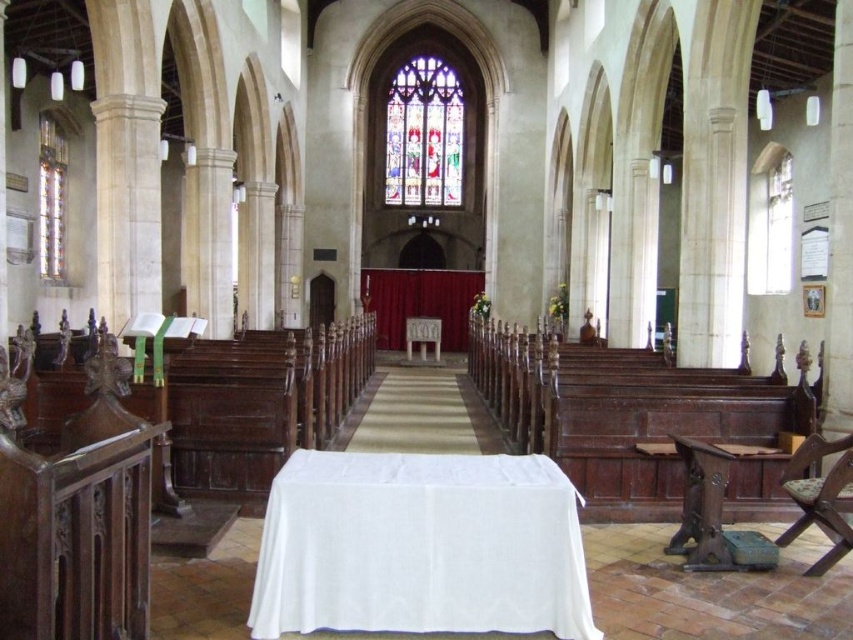
You are a visitor standing at the entrance of the church. You see the white cloth at center and the dark brown wooden chair at lower right. Which object is closer to you?

The white cloth at center is closer to you because it is in front of the dark brown wooden chair at lower right.

You are an interior designer planning to place a 1.2 meter wide decorative screen between the dark brown wooden chair at lower right and the white marble altar at center. Can the screen fit between them without overlapping either object?

The dark brown wooden chair at lower right is narrower than the white marble altar at center. However, the description only provides information about their widths relative to each other, not the exact distance between them. Therefore, it is impossible to determine if the 1.2 meter wide screen can fit without knowing the actual space between the two objects.

From the picture: You are standing at the entrance of the church and want to place a 10 meter long banner from the white cloth at center to the dark brown wooden chair at lower right. Is this feasible?

The distance between the white cloth at center and the dark brown wooden chair at lower right is 8.41 meters. Since the banner is 10 meters long, it is longer than the available space, so it won not fit.